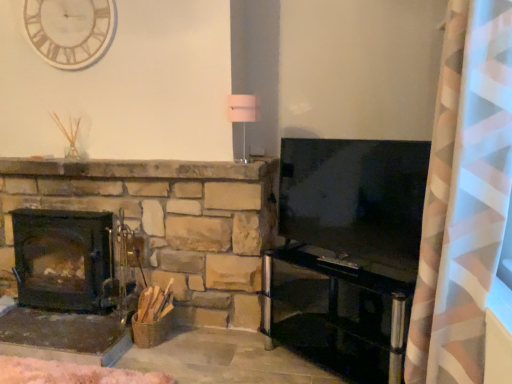
You are a GUI agent. You are given a task and a screenshot of the screen. Output one action in this format:
    pyautogui.click(x=<x>, y=<y>)
    Task: Click on the transparent glass entertainment center at lower right
    This screenshot has width=512, height=384.
    Given the screenshot: What is the action you would take?
    pyautogui.click(x=338, y=311)

Measure the distance between point (71, 62) and camera.

A distance of 8.26 feet exists between point (71, 62) and camera.

This screenshot has width=512, height=384. What are the coordinates of `pink/white striped curtain at right` in the screenshot? It's located at (464, 195).

The height and width of the screenshot is (384, 512). Find the location of `flat-screen tv at right`. flat-screen tv at right is located at coordinates (355, 197).

Can you tell me how much pink/white striped curtain at right and flat-screen tv at right differ in facing direction?

They differ by 53.1 degrees in their facing directions.

Is pink/white striped curtain at right spatially inside flat-screen tv at right, or outside of it?

The correct answer is: outside.

Is point (477, 326) less distant than point (410, 220)?

Yes, point (477, 326) is closer to viewer.

Does pink/white striped curtain at right touch flat-screen tv at right?

There is a gap between pink/white striped curtain at right and flat-screen tv at right.

From the image's perspective, which is below, white wooden clock at upper left or black matte wood burning stove at left?

From the image's view, black matte wood burning stove at left is below.

Between white wooden clock at upper left and black matte wood burning stove at left, which one is positioned behind?

white wooden clock at upper left is behind.

Can you confirm if white wooden clock at upper left is positioned to the right of black matte wood burning stove at left?

Yes.

Which is more to the left, pink/white striped curtain at right or transparent glass entertainment center at lower right?

transparent glass entertainment center at lower right.

Considering the sizes of objects pink/white striped curtain at right and transparent glass entertainment center at lower right in the image provided, who is taller, pink/white striped curtain at right or transparent glass entertainment center at lower right?

Standing taller between the two is pink/white striped curtain at right.

From the image's perspective, is pink/white striped curtain at right on transparent glass entertainment center at lower right?

Yes, from the image's perspective, pink/white striped curtain at right is over transparent glass entertainment center at lower right.

Is pink/white striped curtain at right not within transparent glass entertainment center at lower right?

pink/white striped curtain at right lies outside transparent glass entertainment center at lower right's area.

Consider the image. Is black matte wood burning stove at left to the left or to the right of white wooden clock at upper left in the image?

From the image, it's evident that black matte wood burning stove at left is to the left of white wooden clock at upper left.

Is black matte wood burning stove at left surrounding white wooden clock at upper left?

No, white wooden clock at upper left is located outside of black matte wood burning stove at left.

Locate an element on the screen. This screenshot has height=384, width=512. clock above the black matte wood burning stove at left (from the image's perspective) is located at coordinates (70, 30).

Considering the relative sizes of black matte wood burning stove at left and white wooden clock at upper left in the image provided, is black matte wood burning stove at left smaller than white wooden clock at upper left?

No, black matte wood burning stove at left is not smaller than white wooden clock at upper left.

Which point is more distant from viewer, (14, 214) or (504, 191)?

The point (14, 214) is farther from the camera.

Is black matte wood burning stove at left not close to pink/white striped curtain at right?

black matte wood burning stove at left is positioned a significant distance from pink/white striped curtain at right.

Considering the positions of objects black matte wood burning stove at left and pink/white striped curtain at right in the image provided, who is in front, black matte wood burning stove at left or pink/white striped curtain at right?

pink/white striped curtain at right.

From a real-world perspective, who is located lower, black matte wood burning stove at left or pink/white striped curtain at right?

black matte wood burning stove at left is physically lower.

In the scene shown: Is the position of flat-screen tv at right less distant than that of pink/white striped curtain at right?

No, flat-screen tv at right is further to the viewer.

In the image, is flat-screen tv at right on the left side or the right side of pink/white striped curtain at right?

flat-screen tv at right is to the left of pink/white striped curtain at right.

Based on the photo, does flat-screen tv at right turn towards pink/white striped curtain at right?

No, flat-screen tv at right is not turned towards pink/white striped curtain at right.

Is flat-screen tv at right taller or shorter than pink/white striped curtain at right?

Considering their sizes, flat-screen tv at right has less height than pink/white striped curtain at right.

Considering the relative sizes of transparent glass entertainment center at lower right and pink/white striped curtain at right in the image provided, is transparent glass entertainment center at lower right bigger than pink/white striped curtain at right?

No.

Could you tell me if transparent glass entertainment center at lower right is turned towards pink/white striped curtain at right?

No.

Is transparent glass entertainment center at lower right wider than pink/white striped curtain at right?

No, transparent glass entertainment center at lower right is not wider than pink/white striped curtain at right.

Does point (362, 373) lie behind point (458, 242)?

Yes, it is behind point (458, 242).

Find the location of `television below the pink/white striped curtain at right (from a real-world perspective)`. television below the pink/white striped curtain at right (from a real-world perspective) is located at coordinates (355, 197).

Find the location of `clock above the black matte wood burning stove at left (from the image's perspective)`. clock above the black matte wood burning stove at left (from the image's perspective) is located at coordinates (70, 30).

When comparing their distances from black matte wood burning stove at left, does white wooden clock at upper left or transparent glass entertainment center at lower right seem further?

The object further to black matte wood burning stove at left is transparent glass entertainment center at lower right.

Considering their positions, is transparent glass entertainment center at lower right positioned further to black matte wood burning stove at left than flat-screen tv at right?

The object further to black matte wood burning stove at left is flat-screen tv at right.

Considering their positions, is flat-screen tv at right positioned further to white wooden clock at upper left than pink/white striped curtain at right?

pink/white striped curtain at right.

Based on their spatial positions, is flat-screen tv at right or pink/white striped curtain at right further from transparent glass entertainment center at lower right?

pink/white striped curtain at right is positioned further to the anchor transparent glass entertainment center at lower right.

Based on their spatial positions, is flat-screen tv at right or black matte wood burning stove at left further from white wooden clock at upper left?

Among the two, flat-screen tv at right is located further to white wooden clock at upper left.

Which object lies further to the anchor point flat-screen tv at right, transparent glass entertainment center at lower right or black matte wood burning stove at left?

black matte wood burning stove at left lies further to flat-screen tv at right than the other object.

Based on their spatial positions, is transparent glass entertainment center at lower right or pink/white striped curtain at right further from flat-screen tv at right?

The object further to flat-screen tv at right is pink/white striped curtain at right.

Estimate the real-world distances between objects in this image. Which object is further from flat-screen tv at right, white wooden clock at upper left or transparent glass entertainment center at lower right?

white wooden clock at upper left lies further to flat-screen tv at right than the other object.

Image resolution: width=512 pixels, height=384 pixels. Identify the location of entertainment center between white wooden clock at upper left and flat-screen tv at right from left to right. (338, 311).

At what (x,y) coordinates should I click in order to perform the action: click on clock located between black matte wood burning stove at left and transparent glass entertainment center at lower right in the left-right direction. Please return your answer as a coordinate pair (x, y). Looking at the image, I should click on (70, 30).

Image resolution: width=512 pixels, height=384 pixels. Identify the location of entertainment center between white wooden clock at upper left and pink/white striped curtain at right. (338, 311).

Find the location of a particular element. entertainment center between pink/white striped curtain at right and flat-screen tv at right along the z-axis is located at coordinates (338, 311).